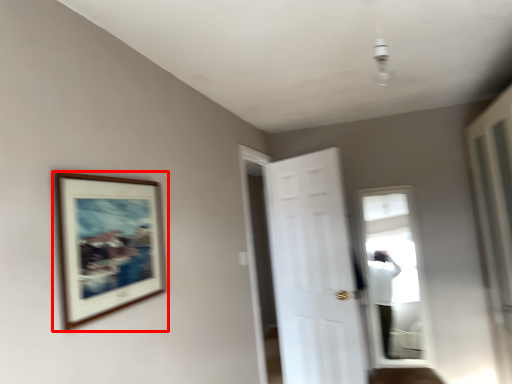
Question: Where is picture frame (annotated by the red box) located in relation to door in the image?

Choices:
 (A) right
 (B) left

Answer: (B)